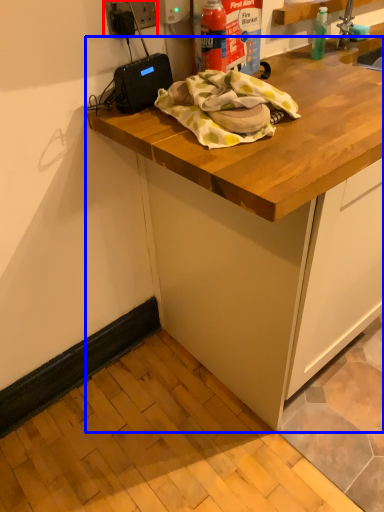
Question: Which object is further to the camera taking this photo, electric outlet (highlighted by a red box) or cabinetry (highlighted by a blue box)?

Choices:
 (A) electric outlet
 (B) cabinetry

Answer: (A)